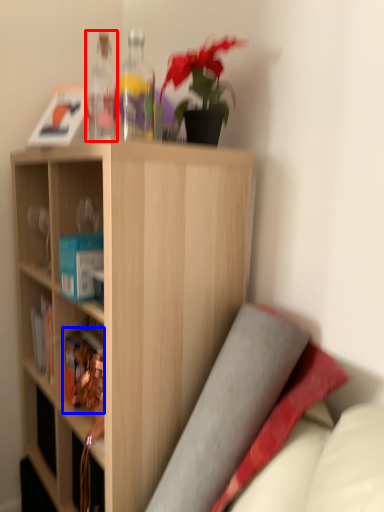
Question: Which object appears closest to the camera in this image, bottle (highlighted by a red box) or book (highlighted by a blue box)?

Choices:
 (A) bottle
 (B) book

Answer: (A)